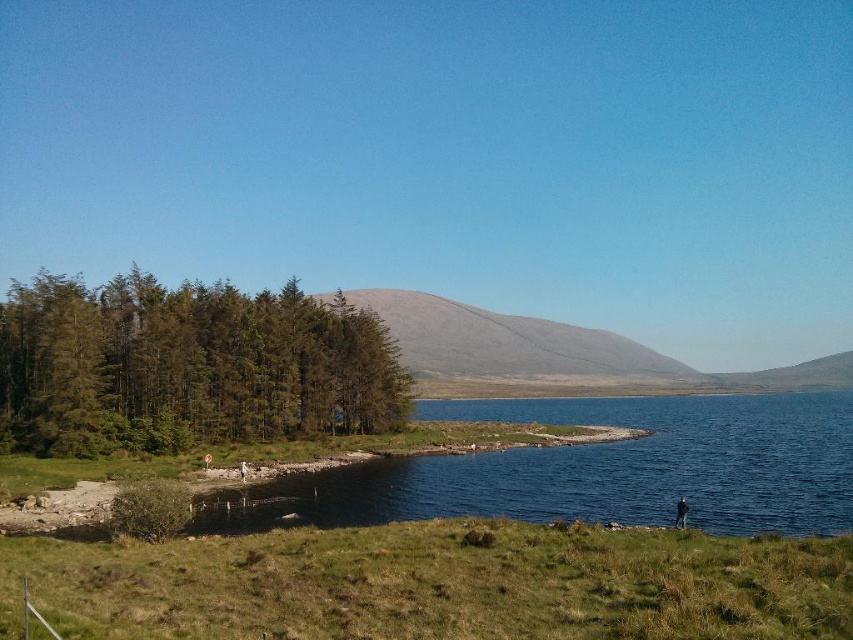
Is green grassy at lower center wider than green textured trees at left?

Incorrect, green grassy at lower center's width does not surpass green textured trees at left's.

What are the coordinates of `green grassy at lower center` in the screenshot? It's located at (434, 584).

Is green grassy at lower center bigger than gray matte hillside at center?

Actually, green grassy at lower center might be smaller than gray matte hillside at center.

Is green grassy at lower center to the left of gray matte hillside at center from the viewer's perspective?

Indeed, green grassy at lower center is positioned on the left side of gray matte hillside at center.

You are a GUI agent. You are given a task and a screenshot of the screen. Output one action in this format:
    pyautogui.click(x=<x>, y=<y>)
    Task: Click on the green grassy at lower center
    This screenshot has width=853, height=640.
    Given the screenshot: What is the action you would take?
    pyautogui.click(x=434, y=584)

Identify the location of green grassy at lower center. (434, 584).

Which of these two, green textured trees at left or gray matte hillside at center, stands taller?

With more height is gray matte hillside at center.

Can you confirm if green textured trees at left is positioned below gray matte hillside at center?

Yes.

At what (x,y) coordinates should I click in order to perform the action: click on green textured trees at left. Please return your answer as a coordinate pair (x, y). The image size is (853, 640). Looking at the image, I should click on (187, 365).

Locate an element on the screen. The width and height of the screenshot is (853, 640). green textured trees at left is located at coordinates (187, 365).